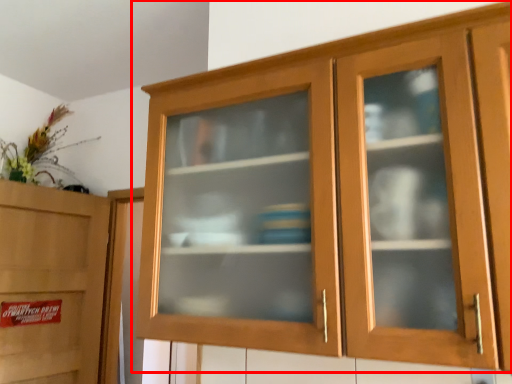
Question: From the image's perspective, considering the relative positions of cupboard (annotated by the red box) and cabinetry in the image provided, where is cupboard (annotated by the red box) located with respect to the staircase?

Choices:
 (A) above
 (B) below

Answer: (A)